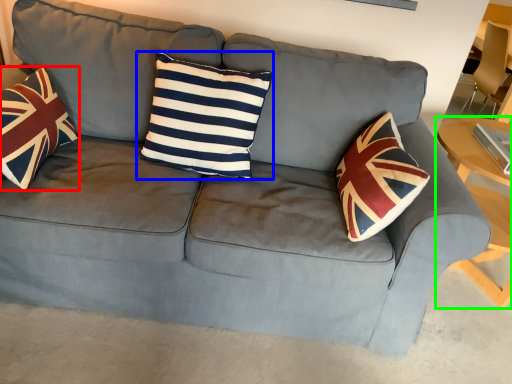
Question: Estimate the real-world distances between objects in this image. Which object is closer to throw pillow (highlighted by a red box), pillow (highlighted by a blue box) or table (highlighted by a green box)?

Choices:
 (A) pillow
 (B) table

Answer: (A)